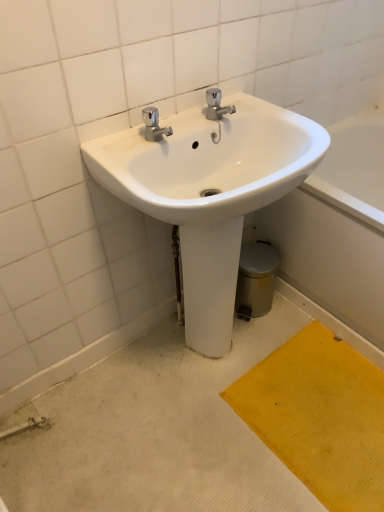
Question: From the image's perspective, is yellow textured mat at lower right below white glossy sink at center?

Choices:
 (A) no
 (B) yes

Answer: (B)

Question: Is yellow textured mat at lower right smaller than white glossy sink at center?

Choices:
 (A) yes
 (B) no

Answer: (A)

Question: From a real-world perspective, is yellow textured mat at lower right located higher than white glossy sink at center?

Choices:
 (A) no
 (B) yes

Answer: (A)

Question: Can you confirm if yellow textured mat at lower right is shorter than white glossy sink at center?

Choices:
 (A) yes
 (B) no

Answer: (A)

Question: From a real-world perspective, is yellow textured mat at lower right located beneath white glossy sink at center?

Choices:
 (A) yes
 (B) no

Answer: (A)

Question: Relative to white glossy bath at lower right, is yellow textured mat at lower right in front or behind?

Choices:
 (A) behind
 (B) front

Answer: (B)

Question: In the image, is yellow textured mat at lower right on the left side or the right side of white glossy bath at lower right?

Choices:
 (A) right
 (B) left

Answer: (B)

Question: Looking at the image, does yellow textured mat at lower right seem bigger or smaller compared to white glossy bath at lower right?

Choices:
 (A) big
 (B) small

Answer: (B)

Question: From a real-world perspective, is yellow textured mat at lower right above or below white glossy bath at lower right?

Choices:
 (A) below
 (B) above

Answer: (A)

Question: Would you say yellow textured mat at lower right is to the left or to the right of white glossy sink at center in the picture?

Choices:
 (A) right
 (B) left

Answer: (A)

Question: Is yellow textured mat at lower right wider or thinner than white glossy sink at center?

Choices:
 (A) wide
 (B) thin

Answer: (A)

Question: Is yellow textured mat at lower right inside the boundaries of white glossy sink at center, or outside?

Choices:
 (A) outside
 (B) inside

Answer: (A)

Question: Is point (375, 380) closer or farther from the camera than point (246, 153)?

Choices:
 (A) farther
 (B) closer

Answer: (A)

Question: In terms of height, does white glossy sink at center look taller or shorter compared to yellow textured mat at lower right?

Choices:
 (A) tall
 (B) short

Answer: (A)

Question: Is white glossy sink at center bigger or smaller than yellow textured mat at lower right?

Choices:
 (A) small
 (B) big

Answer: (B)